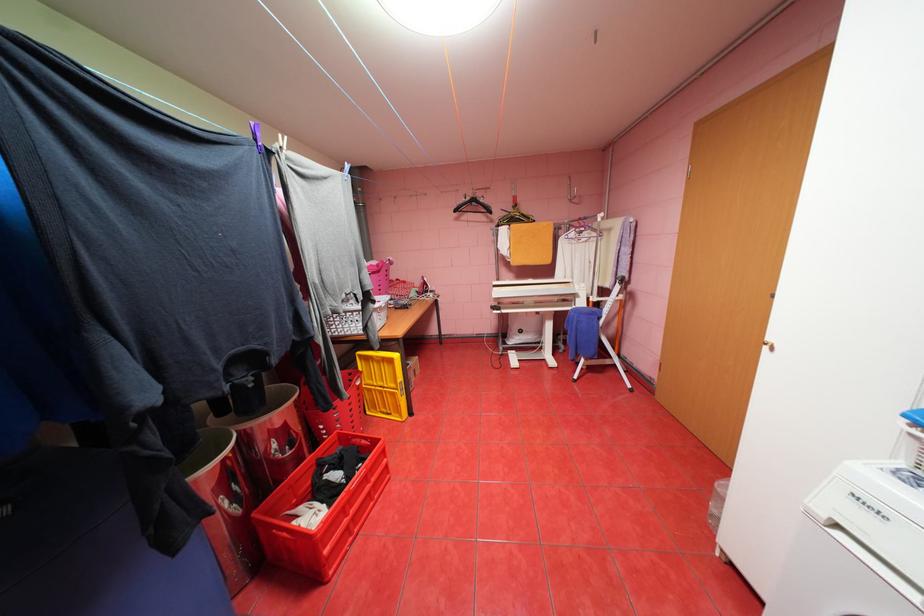
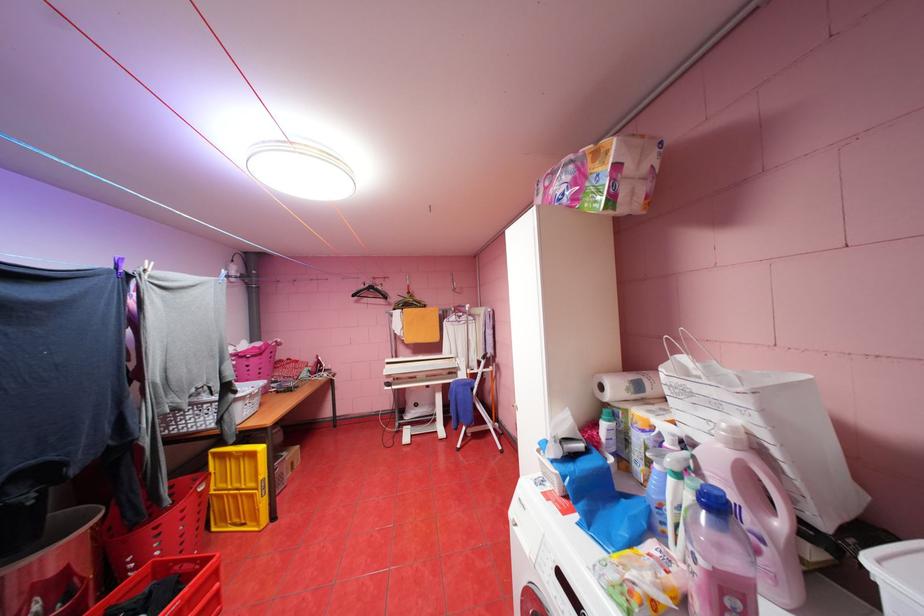
The point at [351,438] is marked in the first image. Where is the corresponding point in the second image?

(169, 569)